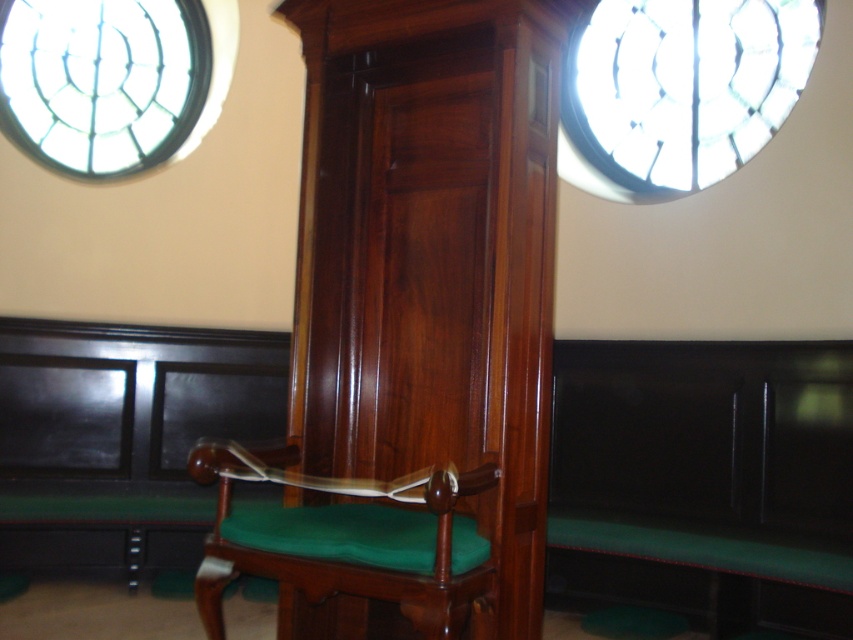
Question: Is green fabric bench at lower left positioned behind green velvet cushion at center?

Choices:
 (A) yes
 (B) no

Answer: (A)

Question: Estimate the real-world distances between objects in this image. Which object is closer to the green fabric bench at lower left?

Choices:
 (A) green velvet cushion at center
 (B) green fabric bench at center

Answer: (A)

Question: Does green fabric bench at lower left have a lesser width compared to green velvet cushion at center?

Choices:
 (A) no
 (B) yes

Answer: (A)

Question: Among these points, which one is farthest from the camera?

Choices:
 (A) (126, 490)
 (B) (721, 349)
 (C) (227, 547)

Answer: (A)

Question: Can you confirm if green fabric bench at lower left is smaller than green velvet cushion at center?

Choices:
 (A) yes
 (B) no

Answer: (B)

Question: Which of these objects is positioned farthest from the green fabric bench at center?

Choices:
 (A) green velvet cushion at center
 (B) green fabric bench at lower left

Answer: (B)